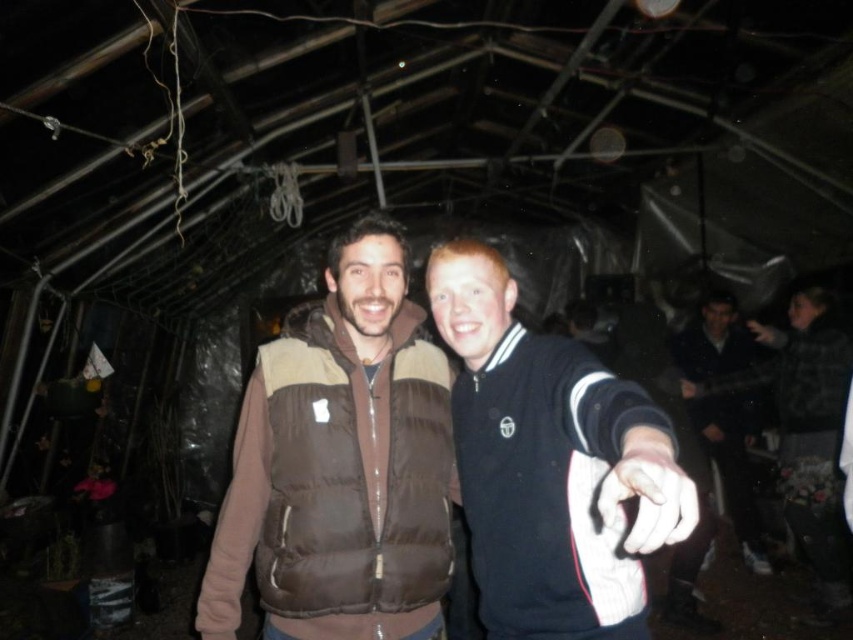
You are a photographer trying to capture a clear shot of both the brown puffy vest at center and the matte black hand at upper right in the dimly lit tent. Since the vest is larger, will you need to adjust your camera focus differently for each object to ensure both are in focus?

The brown puffy vest at center is larger than the matte black hand at upper right, so you should focus on the vest first to ensure its details are sharp, then adjust slightly for the smaller hand to keep both in focus.

You are standing at the origin point in the image. There is a brown puffy vest at center located at point (x=341, y=465). If you move 0.1 units to the right, will you be closer to or farther from the brown puffy vest at center?

Moving 0.1 units to the right from the origin point would take you to 0.828, 0.401. Since the brown puffy vest at center is at (x=341, y=465), moving right increases the x coordinate, so you would be farther from the brown puffy vest at center.

Looking at this image, you are a photographer trying to capture a photo of the black fleece jacket at center and the white matte hand at center. Which object should you focus on first if you want to ensure both are in the frame without moving the camera?

The black fleece jacket at center is positioned on the left side of the white matte hand at center, so you should focus on the black fleece jacket at center first to ensure both are in the frame without moving the camera.